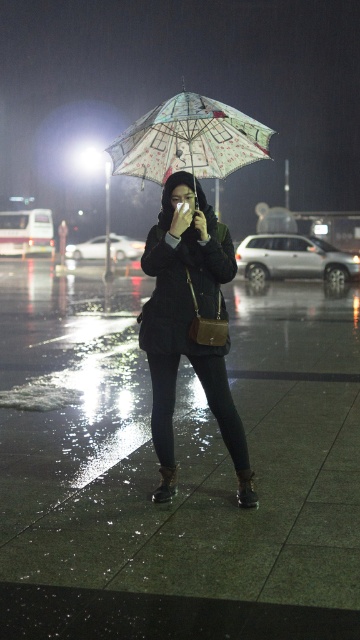
Question: Is glossy concrete pavement at center in front of patterned fabric umbrella at center?

Choices:
 (A) no
 (B) yes

Answer: (B)

Question: Which of the following is the closest to the observer?

Choices:
 (A) glossy concrete pavement at center
 (B) patterned fabric umbrella at center
 (C) dark matte jacket at center

Answer: (A)

Question: Can you confirm if dark matte jacket at center is positioned to the left of patterned fabric umbrella at center?

Choices:
 (A) yes
 (B) no

Answer: (B)

Question: Estimate the real-world distances between objects in this image. Which object is farther from the glossy concrete pavement at center?

Choices:
 (A) patterned fabric umbrella at center
 (B) dark matte jacket at center

Answer: (A)

Question: Is dark matte jacket at center to the left of patterned fabric umbrella at center from the viewer's perspective?

Choices:
 (A) yes
 (B) no

Answer: (B)

Question: Estimate the real-world distances between objects in this image. Which object is closer to the dark matte jacket at center?

Choices:
 (A) glossy concrete pavement at center
 (B) patterned fabric umbrella at center

Answer: (B)